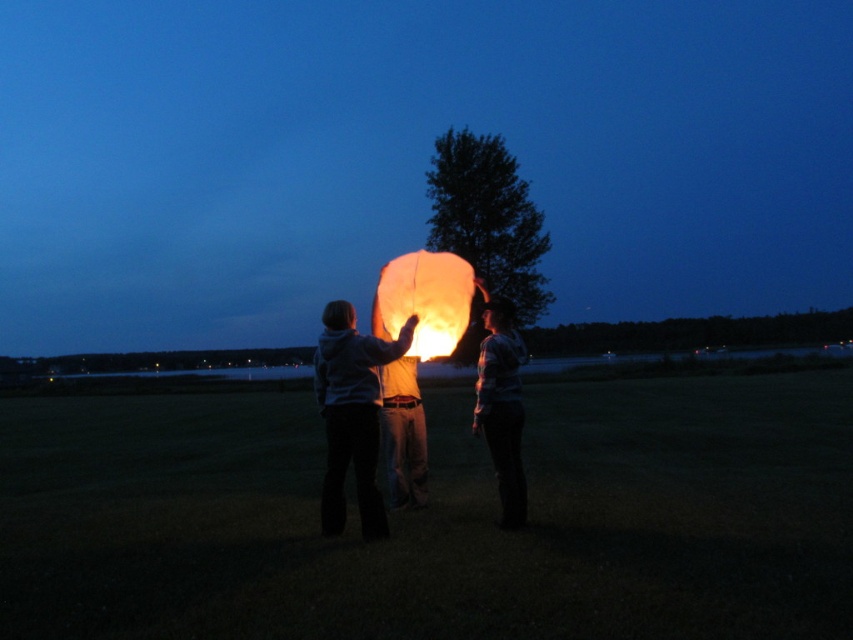
Which is in front, point (413, 394) or point (468, 294)?

Positioned in front is point (413, 394).

Where is `matte white lantern at center`? The image size is (853, 640). matte white lantern at center is located at coordinates (368, 417).

Find the location of a particular element. matte white lantern at center is located at coordinates (368, 417).

Who is more distant from viewer, (514,412) or (422,454)?

Point (422,454)

Does matte white lantern at center have a larger size compared to matte white paper lantern at center?

Indeed, matte white lantern at center has a larger size compared to matte white paper lantern at center.

Does point (399, 460) come farther from viewer compared to point (415, 472)?

No, it is not.

Where is `matte white lantern at center`? This screenshot has height=640, width=853. matte white lantern at center is located at coordinates [x=368, y=417].

Can you confirm if translucent paper lantern at center is positioned to the right of matte white shirt at center?

In fact, translucent paper lantern at center is to the left of matte white shirt at center.

Based on the photo, does translucent paper lantern at center come in front of matte white shirt at center?

No, translucent paper lantern at center is behind matte white shirt at center.

This screenshot has width=853, height=640. I want to click on translucent paper lantern at center, so click(424, 301).